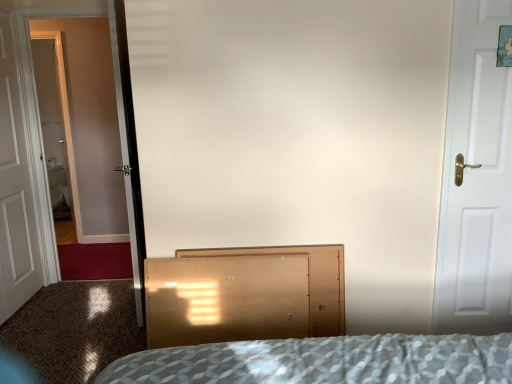
Question: From the image's perspective, would you say white matte door at right, arranged as the second door when viewed from the back, is positioned over white wooden door at left, which appears as the first door when viewed from the back?

Choices:
 (A) no
 (B) yes

Answer: (A)

Question: From the image's perspective, is white matte door at right, which is the 1th door in right-to-left order, under white wooden door at left, which appears as the first door when viewed from the left?

Choices:
 (A) yes
 (B) no

Answer: (A)

Question: Is white matte door at right, which is the 1th door in right-to-left order, positioned before white wooden door at left, which appears as the first door when viewed from the left?

Choices:
 (A) no
 (B) yes

Answer: (B)

Question: Is white matte door at right, arranged as the second door when viewed from the back, facing towards white wooden door at left, which appears as the first door when viewed from the left?

Choices:
 (A) yes
 (B) no

Answer: (B)

Question: Is white matte door at right, arranged as the second door when viewed from the back, oriented away from white wooden door at left, placed as the second door when sorted from front to back?

Choices:
 (A) yes
 (B) no

Answer: (B)

Question: Can we say white matte door at right, the 1th door viewed from the front, lies outside white wooden door at left, which appears as the first door when viewed from the left?

Choices:
 (A) no
 (B) yes

Answer: (B)

Question: From a real-world perspective, is clear glass screen door at left positioned over light brown wood dresser at center based on gravity?

Choices:
 (A) no
 (B) yes

Answer: (B)

Question: Is clear glass screen door at left placed right next to light brown wood dresser at center?

Choices:
 (A) no
 (B) yes

Answer: (A)

Question: Can you confirm if clear glass screen door at left is positioned to the right of light brown wood dresser at center?

Choices:
 (A) no
 (B) yes

Answer: (A)

Question: From a real-world perspective, is clear glass screen door at left located beneath light brown wood dresser at center?

Choices:
 (A) yes
 (B) no

Answer: (B)

Question: Is clear glass screen door at left behind light brown wood dresser at center?

Choices:
 (A) yes
 (B) no

Answer: (A)

Question: Considering the relative sizes of clear glass screen door at left and light brown wood dresser at center in the image provided, is clear glass screen door at left bigger than light brown wood dresser at center?

Choices:
 (A) yes
 (B) no

Answer: (A)

Question: Considering the relative positions of white wooden door at left, which appears as the first door when viewed from the left, and light brown wood dresser at center in the image provided, is white wooden door at left, which appears as the first door when viewed from the left, to the right of light brown wood dresser at center from the viewer's perspective?

Choices:
 (A) no
 (B) yes

Answer: (A)